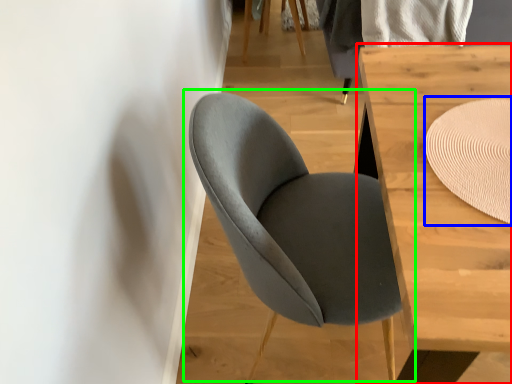
Question: Which object is the farthest from table (highlighted by a red box)? Choose among these: mat (highlighted by a blue box) or chair (highlighted by a green box).

Choices:
 (A) mat
 (B) chair

Answer: (B)